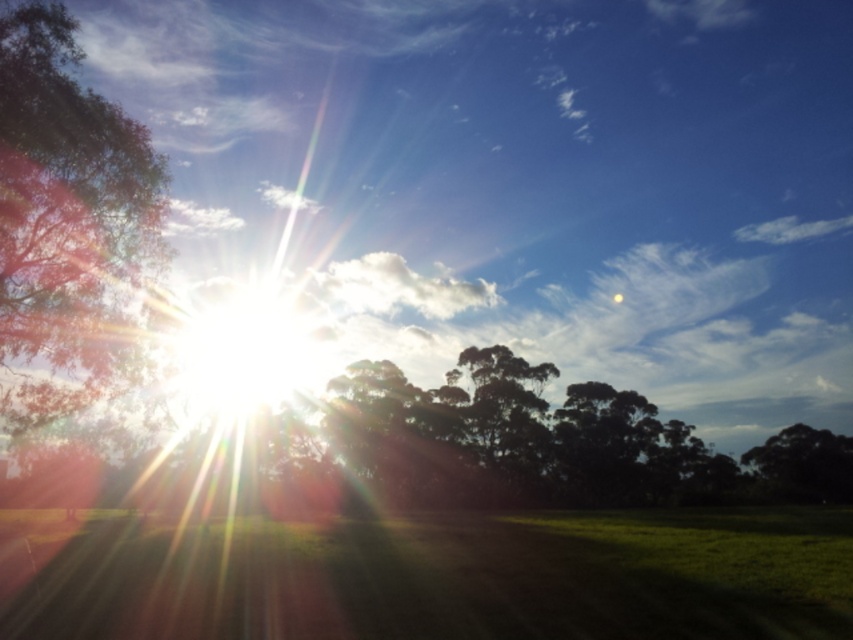
Who is more forward, (68, 288) or (827, 483)?

Point (68, 288)

Is green leafy tree at left shorter than green leafy tree at right?

No, green leafy tree at left is not shorter than green leafy tree at right.

Where is `green leafy tree at left`? This screenshot has width=853, height=640. green leafy tree at left is located at coordinates (67, 218).

Can you confirm if green leafy tree at left is positioned above green leafy tree at center?

Yes.

Is the position of green leafy tree at left less distant than that of green leafy tree at center?

Yes, it is.

Which is in front, point (120, 272) or point (537, 416)?

Point (120, 272) is more forward.

Image resolution: width=853 pixels, height=640 pixels. I want to click on green leafy tree at left, so click(x=67, y=218).

Is green leafy tree at center bigger than green leafy tree at right?

Incorrect, green leafy tree at center is not larger than green leafy tree at right.

From the picture: Is green leafy tree at center to the left of green leafy tree at right from the viewer's perspective?

Indeed, green leafy tree at center is positioned on the left side of green leafy tree at right.

Locate an element on the screen. Image resolution: width=853 pixels, height=640 pixels. green leafy tree at center is located at coordinates (508, 412).

Locate an element on the screen. This screenshot has height=640, width=853. green leafy tree at center is located at coordinates (508, 412).